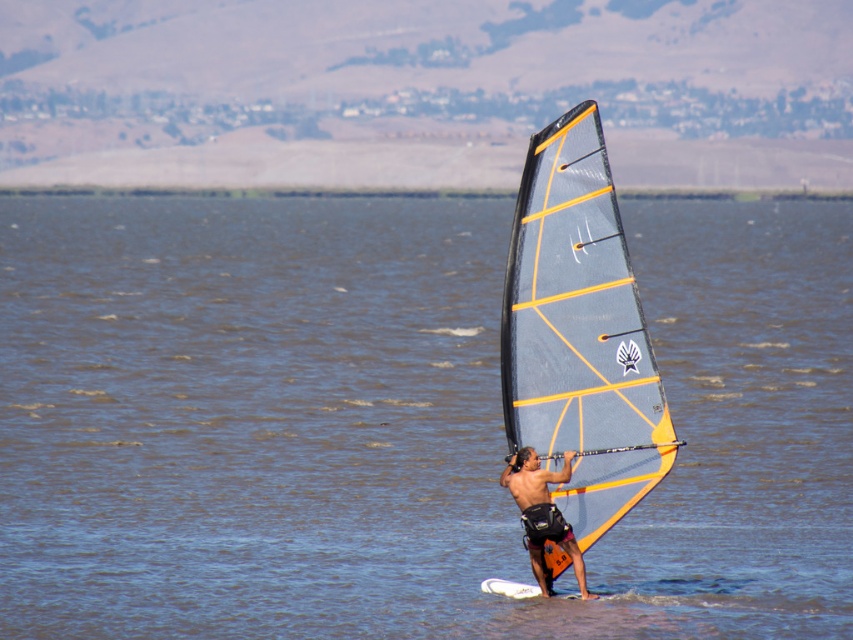
You are a photographer trying to capture the windsurfer in the image. You need to position yourself so that the clear blue water at center and the matte black wetsuit at center are both visible in your shot. Which object should you place closer to the left side of your frame?

You should place the clear blue water at center closer to the left side of your frame because it is already positioned on the left side of the matte black wetsuit at center.

You are a photographer standing on the shore and want to capture the windsurfer in the clear blue water at center. If your camera has a maximum focus range of 20 meters, will you be able to clearly photograph the windsurfer?

The clear blue water at center is 20.76 meters away from the camera. Since the maximum focus range is 20 meters, the camera cannot focus clearly on the windsurfer at that distance.